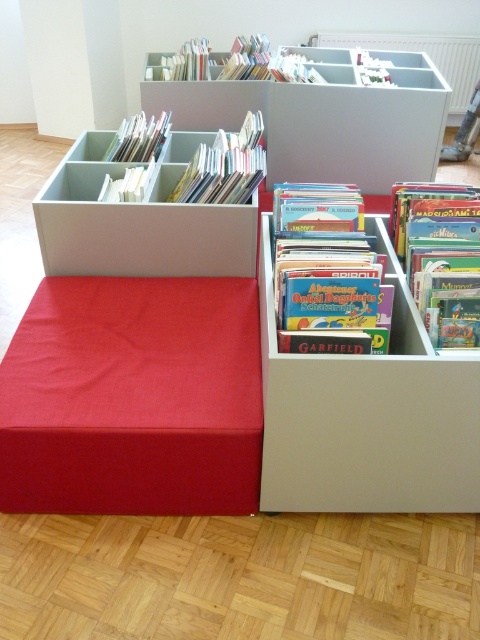
Question: Can you confirm if matte gray bookshelf at upper center is wider than matte plastic storage at center?

Choices:
 (A) no
 (B) yes

Answer: (B)

Question: Among these objects, which one is nearest to the camera?

Choices:
 (A) matte cardboard bookshelf at center
 (B) hardcover book at center
 (C) white paper book at upper center

Answer: (A)

Question: In this image, where is matte cardboard book at center located relative to matte paper book at upper left?

Choices:
 (A) above
 (B) below

Answer: (B)

Question: Is matte gray bookshelf at upper center thinner than white paper book at upper center?

Choices:
 (A) yes
 (B) no

Answer: (B)

Question: Among these points, which one is farthest from the camera?

Choices:
 (A) (204, 70)
 (B) (454, 250)

Answer: (A)

Question: Estimate the real-world distances between objects in this image. Which object is closer to the matte plastic storage at center?

Choices:
 (A) matte gray bookshelf at upper center
 (B) matte cardboard book at center
 (C) matte paper book at upper left

Answer: (B)